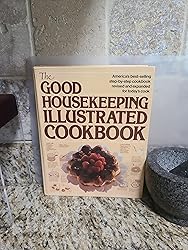
At what (x,y) coordinates should I click in order to perform the action: click on tile. Please return your answer as a coordinate pair (x, y). Looking at the image, I should click on (149, 30), (77, 32), (18, 34), (23, 115).